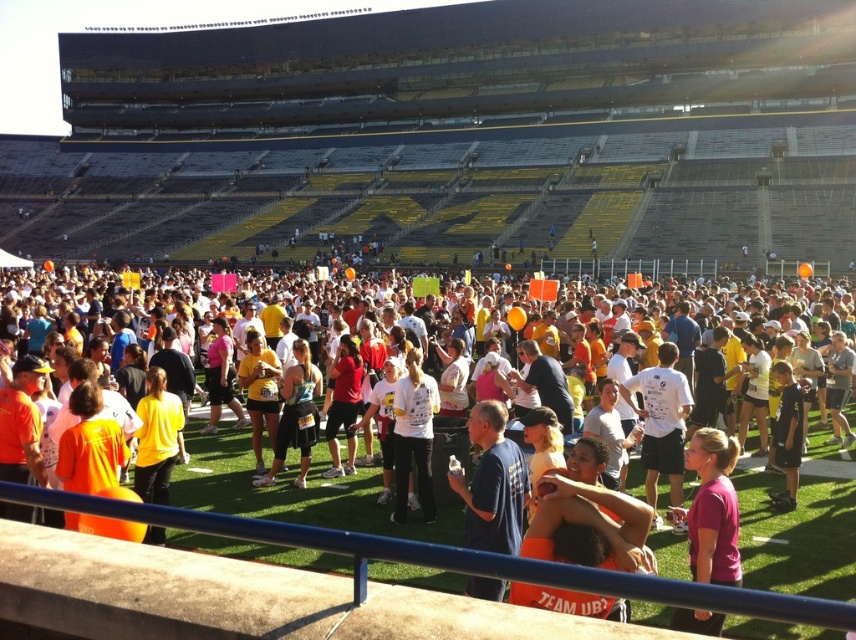
Is point (718, 561) less distant than point (651, 416)?

Yes, it is.

Between purple matte shirt at center and white matte t-shirt at center, which one is positioned lower?

purple matte shirt at center is below.

Identify the location of purple matte shirt at center. (712, 509).

Is white cotton shirt at center positioned behind yellow matte shirt at center?

Yes, white cotton shirt at center is further from the viewer.

Who is more distant from viewer, (403, 413) or (161, 426)?

The point (403, 413) is more distant.

Does point (432, 404) come in front of point (147, 433)?

No, it is not.

Find the location of a particular element. white cotton shirt at center is located at coordinates (413, 436).

Is purple matte shirt at center bigger than white cotton shirt at center?

No.

You are a GUI agent. You are given a task and a screenshot of the screen. Output one action in this format:
    pyautogui.click(x=<x>, y=<y>)
    Task: Click on the purple matte shirt at center
    
    Given the screenshot: What is the action you would take?
    pyautogui.click(x=712, y=509)